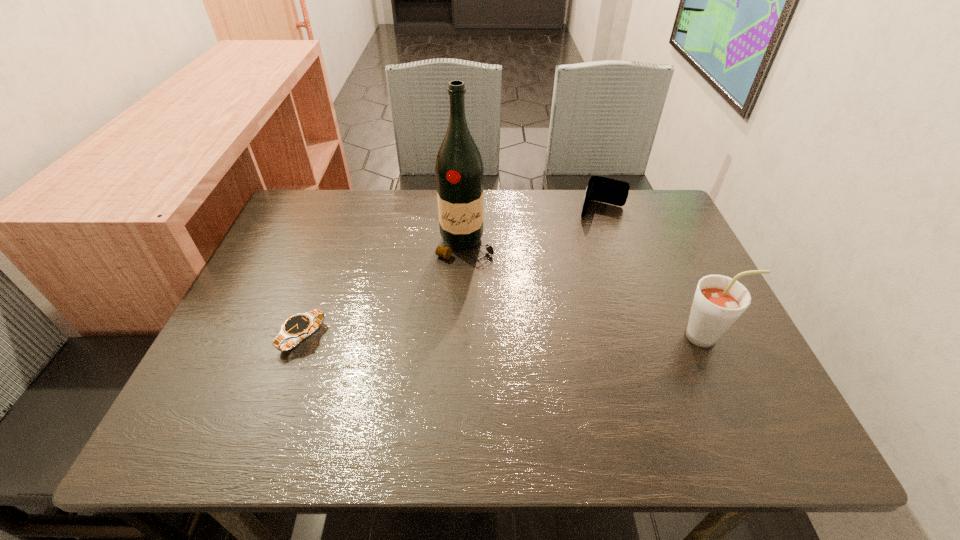
You are a GUI agent. You are given a task and a screenshot of the screen. Output one action in this format:
    pyautogui.click(x=<x>, y=<y>)
    Task: Click on the free spot located 0.050m on the surface of the tallest object
    The height and width of the screenshot is (540, 960).
    Given the screenshot: What is the action you would take?
    pyautogui.click(x=466, y=278)

Find the location of `free space located on the surface of the tallest object`. free space located on the surface of the tallest object is located at coordinates (468, 383).

Locate an element on the screen. The width and height of the screenshot is (960, 540). vacant space located on the outer surface of the farthest object is located at coordinates (567, 320).

Identify the location of vacant space situated 0.370m on the outer surface of the farthest object. (570, 310).

The height and width of the screenshot is (540, 960). I want to click on free location located 0.140m on the outer surface of the farthest object, so click(x=588, y=250).

At what (x,y) coordinates should I click in order to perform the action: click on wine bottle located at the far edge. Please return your answer as a coordinate pair (x, y). Looking at the image, I should click on (459, 171).

Find the location of `wallet at the far edge`. wallet at the far edge is located at coordinates (602, 189).

Find the location of a particular element. This screenshot has height=540, width=960. object positioned at the left edge is located at coordinates (300, 326).

Locate an element on the screen. The image size is (960, 540). root beer positioned at the right edge is located at coordinates click(x=719, y=301).

Where is `wallet positioned at the right edge`? The image size is (960, 540). wallet positioned at the right edge is located at coordinates (602, 189).